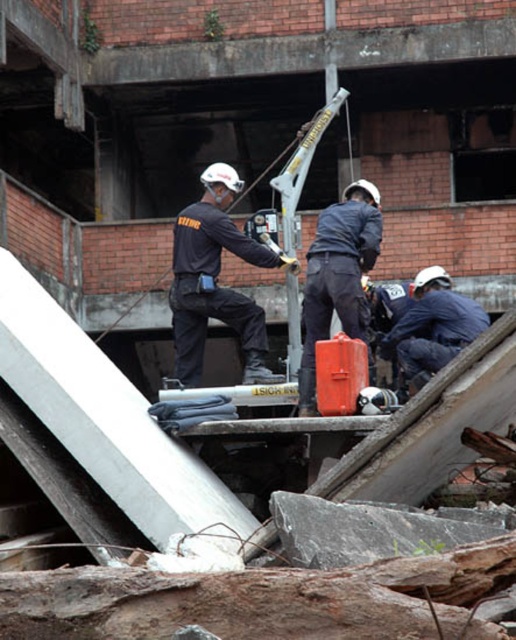
Is blue fabric at lower right behind metallic silver crane at center?

Yes, it is.

Is blue fabric at lower right below metallic silver crane at center?

Correct, blue fabric at lower right is located below metallic silver crane at center.

Describe the element at coordinates (432, 326) in the screenshot. I see `blue fabric at lower right` at that location.

Where is `blue fabric at lower right`? blue fabric at lower right is located at coordinates (432, 326).

Is point (203, 180) positioned after point (282, 236)?

Yes, it is behind point (282, 236).

Between point (233, 168) and point (301, 189), which one is positioned behind?

The point (233, 168) is behind.

Identify the location of black matte uniform at center. The width and height of the screenshot is (516, 640). (216, 280).

The image size is (516, 640). Describe the element at coordinates (216, 280) in the screenshot. I see `black matte uniform at center` at that location.

Does black matte uniform at center appear on the left side of matte orange tool box at center?

Correct, you'll find black matte uniform at center to the left of matte orange tool box at center.

Does point (183, 241) come in front of point (358, 204)?

No.

Where is `black matte uniform at center`? The image size is (516, 640). black matte uniform at center is located at coordinates (216, 280).